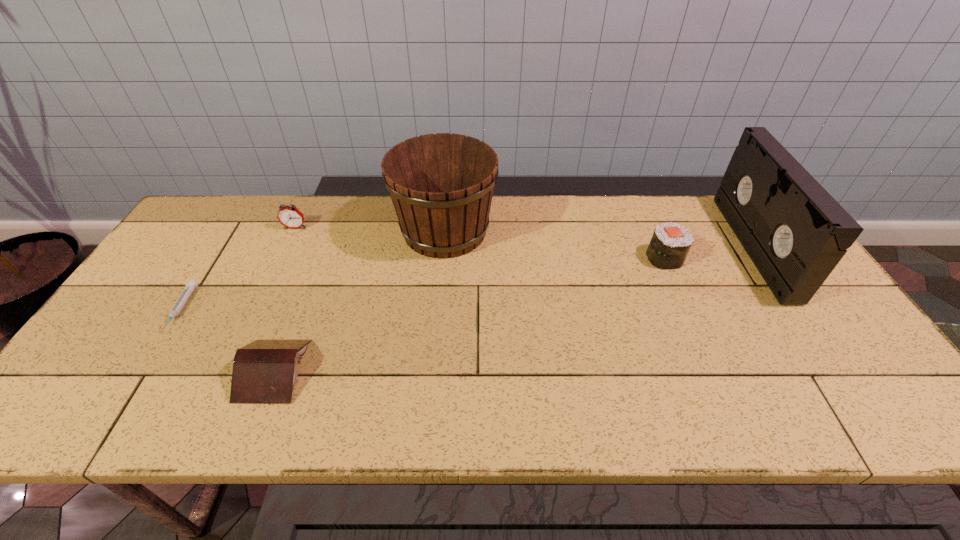
Find the location of `free space that satisfies the following two spatial constraints: 1. on the side of the videotape with visible spindles; 2. on the front side of the book`. free space that satisfies the following two spatial constraints: 1. on the side of the videotape with visible spindles; 2. on the front side of the book is located at coordinates (835, 370).